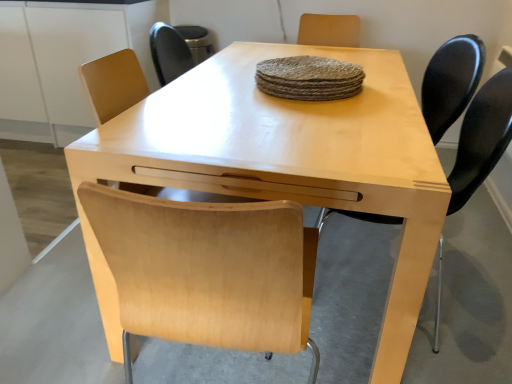
Question: Considering the relative sizes of matte black chair at right, the first chair when ordered from back to front, and light wood table at center in the image provided, is matte black chair at right, the first chair when ordered from back to front, shorter than light wood table at center?

Choices:
 (A) yes
 (B) no

Answer: (B)

Question: Are matte black chair at right, the first chair when ordered from back to front, and light wood table at center making contact?

Choices:
 (A) yes
 (B) no

Answer: (B)

Question: Is matte black chair at right, the 2th chair viewed from the front, at the left side of light wood table at center?

Choices:
 (A) no
 (B) yes

Answer: (A)

Question: Is matte black chair at right, the first chair when ordered from back to front, taller than light wood table at center?

Choices:
 (A) yes
 (B) no

Answer: (A)

Question: Is light wood table at center completely or partially inside matte black chair at right, the first chair when ordered from back to front?

Choices:
 (A) no
 (B) yes

Answer: (A)

Question: From the image's perspective, is matte black chair at right, the 2th chair viewed from the front, located above light wood table at center?

Choices:
 (A) no
 (B) yes

Answer: (B)

Question: Is light wood table at center turned away from matte black chair at right, the 1th chair positioned from the front?

Choices:
 (A) yes
 (B) no

Answer: (A)

Question: Is light wood table at center positioned before matte black chair at right, positioned as the 2th chair in back-to-front order?

Choices:
 (A) yes
 (B) no

Answer: (A)

Question: Considering the relative positions of light wood table at center and matte black chair at right, positioned as the 2th chair in back-to-front order, in the image provided, is light wood table at center behind matte black chair at right, positioned as the 2th chair in back-to-front order,?

Choices:
 (A) yes
 (B) no

Answer: (B)

Question: From the image's perspective, is light wood table at center on top of matte black chair at right, positioned as the 2th chair in back-to-front order?

Choices:
 (A) no
 (B) yes

Answer: (B)

Question: Is light wood table at center far away from matte black chair at right, positioned as the 2th chair in back-to-front order?

Choices:
 (A) yes
 (B) no

Answer: (B)

Question: Is light wood table at center shorter than matte black chair at right, the 1th chair positioned from the front?

Choices:
 (A) no
 (B) yes

Answer: (B)

Question: Does light wood table at center have a greater height compared to matte black chair at right, positioned as the 2th chair in back-to-front order?

Choices:
 (A) yes
 (B) no

Answer: (B)